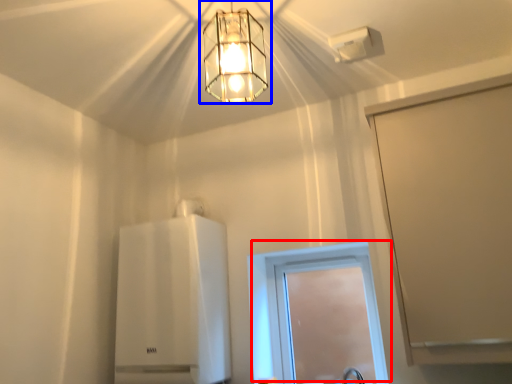
Question: Which point is further to the camera, window (highlighted by a red box) or lamp (highlighted by a blue box)?

Choices:
 (A) window
 (B) lamp

Answer: (A)